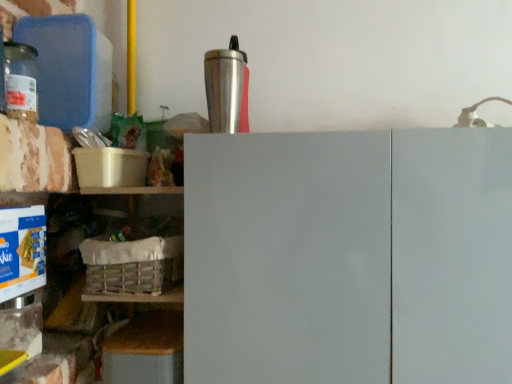
Image resolution: width=512 pixels, height=384 pixels. Describe the element at coordinates (133, 265) in the screenshot. I see `white woven basket at lower left` at that location.

What do you see at coordinates (61, 215) in the screenshot?
I see `wooden crate at lower left` at bounding box center [61, 215].

The height and width of the screenshot is (384, 512). In order to click on white woven basket at lower left in this screenshot , I will do `click(133, 265)`.

Between silver metallic tumbler at upper center and white woven basket at lower left, which one has smaller width?

Thinner between the two is silver metallic tumbler at upper center.

From the image's perspective, does silver metallic tumbler at upper center appear lower than white woven basket at lower left?

Incorrect, from the image's perspective, silver metallic tumbler at upper center is higher than white woven basket at lower left.

Considering the positions of objects silver metallic tumbler at upper center and white woven basket at lower left in the image provided, who is more to the left, silver metallic tumbler at upper center or white woven basket at lower left?

white woven basket at lower left.

In the scene shown: Would you say silver metallic tumbler at upper center is inside or outside white woven basket at lower left?

silver metallic tumbler at upper center is spatially situated outside white woven basket at lower left.

Consider the image. Does silver metallic tumbler at upper center come in front of translucent glass jar at left?

No, silver metallic tumbler at upper center is further to the viewer.

Who is bigger, silver metallic tumbler at upper center or translucent glass jar at left?

Bigger between the two is silver metallic tumbler at upper center.

Find the location of a particular element. Image resolution: width=512 pixels, height=384 pixels. bottle located on the left of silver metallic tumbler at upper center is located at coordinates (21, 81).

How different are the orientations of white matte cabinet doors at center and silver metallic tumbler at upper center in degrees?

They differ by 0.00377 degrees in their facing directions.

Is white matte cabinet doors at center to the right of silver metallic tumbler at upper center from the viewer's perspective?

Correct, you'll find white matte cabinet doors at center to the right of silver metallic tumbler at upper center.

Who is shorter, white matte cabinet doors at center or silver metallic tumbler at upper center?

silver metallic tumbler at upper center is shorter.

From the image's perspective, is white matte cabinet doors at center above or below silver metallic tumbler at upper center?

white matte cabinet doors at center is below silver metallic tumbler at upper center.

Is translucent glass jar at left positioned with its back to white woven basket at lower left?

No, translucent glass jar at left is not facing the opposite direction of white woven basket at lower left.

From the image's perspective, who appears lower, translucent glass jar at left or white woven basket at lower left?

white woven basket at lower left, from the image's perspective.

Where is `basket behind the translucent glass jar at left`? basket behind the translucent glass jar at left is located at coordinates (133, 265).

Which of these two, translucent glass jar at left or white woven basket at lower left, stands shorter?

With less height is translucent glass jar at left.

How different are the orientations of translucent glass jar at left and wooden crate at lower left in degrees?

They differ by 89.8 degrees in their facing directions.

From a real-world perspective, which is physically below, translucent glass jar at left or wooden crate at lower left?

In real-world perspective, wooden crate at lower left is lower.

Would you consider translucent glass jar at left to be distant from wooden crate at lower left?

No, translucent glass jar at left is not far away from wooden crate at lower left.

Is white woven basket at lower left bigger than white matte cabinet doors at center?

No, white woven basket at lower left is not bigger than white matte cabinet doors at center.

Where is `cabinetry lying below the white woven basket at lower left (from the image's perspective)`? This screenshot has height=384, width=512. cabinetry lying below the white woven basket at lower left (from the image's perspective) is located at coordinates (349, 257).

Does white woven basket at lower left appear on the left side of white matte cabinet doors at center?

Correct, you'll find white woven basket at lower left to the left of white matte cabinet doors at center.

Considering the points (29, 87) and (468, 265), which point is behind, point (29, 87) or point (468, 265)?

Point (29, 87)

Which object is wider, translucent glass jar at left or white matte cabinet doors at center?

white matte cabinet doors at center.

From the image's perspective, is translucent glass jar at left positioned above or below white matte cabinet doors at center?

translucent glass jar at left is above white matte cabinet doors at center.

Where is `appliance above the white woven basket at lower left (from the image's perspective)`? This screenshot has height=384, width=512. appliance above the white woven basket at lower left (from the image's perspective) is located at coordinates (227, 88).

The height and width of the screenshot is (384, 512). I want to click on bottle directly beneath the silver metallic tumbler at upper center (from a real-world perspective), so click(x=21, y=81).

Considering their positions, is translucent glass jar at left positioned further to white matte cabinet doors at center than white woven basket at lower left?

translucent glass jar at left is further to white matte cabinet doors at center.

Consider the image. Estimate the real-world distances between objects in this image. Which object is closer to silver metallic tumbler at upper center, wooden crate at lower left or translucent glass jar at left?

wooden crate at lower left is closer to silver metallic tumbler at upper center.

Considering their positions, is white matte cabinet doors at center positioned closer to wooden crate at lower left than white woven basket at lower left?

Based on the image, white woven basket at lower left appears to be nearer to wooden crate at lower left.

Estimate the real-world distances between objects in this image. Which object is further from silver metallic tumbler at upper center, translucent glass jar at left or white matte cabinet doors at center?

translucent glass jar at left is positioned further to the anchor silver metallic tumbler at upper center.

Which object lies nearer to the anchor point silver metallic tumbler at upper center, translucent glass jar at left or wooden crate at lower left?

The object closer to silver metallic tumbler at upper center is wooden crate at lower left.

When comparing their distances from white woven basket at lower left, does wooden crate at lower left or white matte cabinet doors at center seem further?

white matte cabinet doors at center.

Based on the photo, estimate the real-world distances between objects in this image. Which object is further from white woven basket at lower left, white matte cabinet doors at center or wooden crate at lower left?

Among the two, white matte cabinet doors at center is located further to white woven basket at lower left.

Based on their spatial positions, is white matte cabinet doors at center or translucent glass jar at left closer to silver metallic tumbler at upper center?

Based on the image, white matte cabinet doors at center appears to be nearer to silver metallic tumbler at upper center.

Where is `appliance between translucent glass jar at left and white matte cabinet doors at center from left to right`? appliance between translucent glass jar at left and white matte cabinet doors at center from left to right is located at coordinates (227, 88).

Identify the location of basket between translucent glass jar at left and white matte cabinet doors at center in the horizontal direction. (133, 265).

Locate an element on the screen. cabinetry between silver metallic tumbler at upper center and wooden crate at lower left in the up-down direction is located at coordinates (349, 257).

The image size is (512, 384). Identify the location of basket between translucent glass jar at left and wooden crate at lower left vertically. (133, 265).